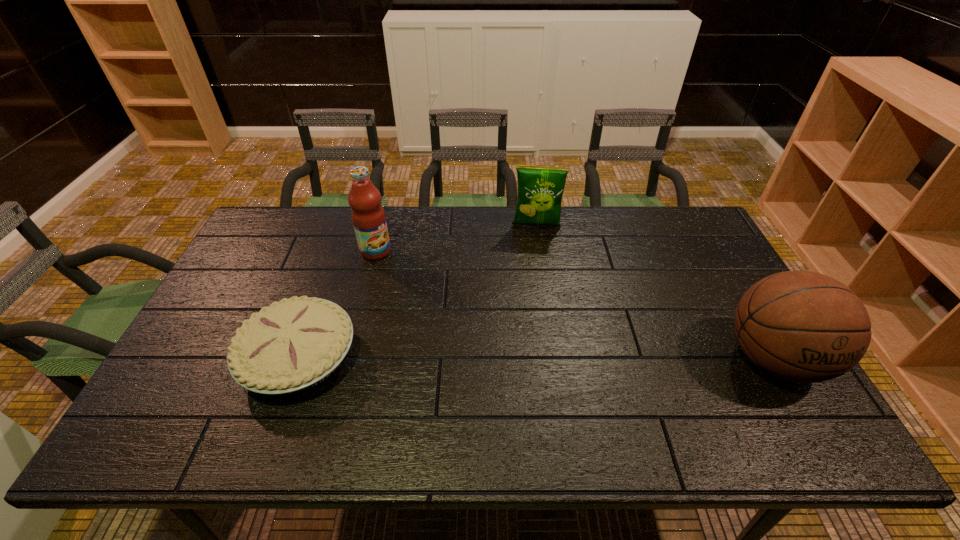
In order to click on empty space between the third object from left to right and the rightmost object in this screenshot , I will do `click(655, 293)`.

Identify the location of free space between the farthest object and the rightmost object. (655, 293).

Find the location of a particular element. vacant space that is in between the second object from right to left and the second farthest object is located at coordinates (456, 239).

Where is `free space that is in between the rightmost object and the third nearest object`? This screenshot has height=540, width=960. free space that is in between the rightmost object and the third nearest object is located at coordinates [x=574, y=305].

Where is `vacant area that lies between the basketball and the shortest object`? The image size is (960, 540). vacant area that lies between the basketball and the shortest object is located at coordinates (536, 357).

This screenshot has height=540, width=960. What are the coordinates of `the second closest object relative to the shortest object` in the screenshot? It's located at (540, 188).

Point out which object is positioned as the second nearest to the pie. Please provide its 2D coordinates. Your answer should be formatted as a tuple, i.e. [(x, y)], where the tuple contains the x and y coordinates of a point satisfying the conditions above.

[(540, 188)]

What are the coordinates of `vacant space that satisfies the following two spatial constraints: 1. on the back side of the farthest object; 2. on the right side of the pie` in the screenshot? It's located at (346, 226).